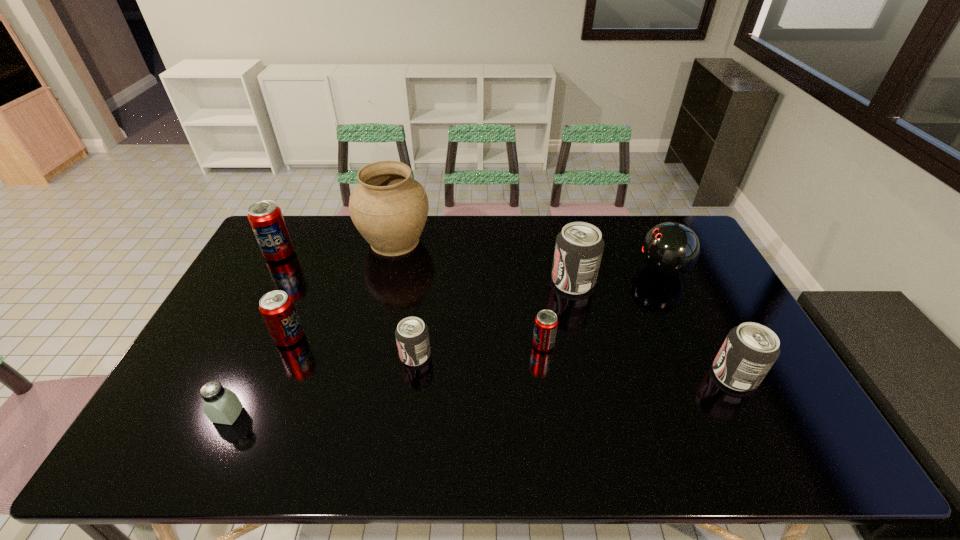
At what (x,y) coordinates should I click in order to perform the action: click on soda can positioned at the left edge. Please return your answer as a coordinate pair (x, y). Looking at the image, I should click on (266, 219).

Find the location of a particular element. saltshaker located at the left edge is located at coordinates (221, 405).

Locate an element on the screen. bowling ball located in the right edge section of the desktop is located at coordinates (670, 249).

Find the location of a particular element. soda can situated at the right edge is located at coordinates (750, 350).

The width and height of the screenshot is (960, 540). I want to click on object that is positioned at the far left corner, so click(x=266, y=219).

The image size is (960, 540). What are the coordinates of `object that is positioned at the far right corner` in the screenshot? It's located at (670, 249).

The image size is (960, 540). I want to click on vacant area at the far edge of the desktop, so click(x=612, y=251).

Identify the location of free space at the near edge of the desktop. This screenshot has height=540, width=960. (659, 433).

Where is `vacant space at the left edge`? vacant space at the left edge is located at coordinates (189, 407).

The width and height of the screenshot is (960, 540). Identify the location of vacant region at the right edge. (766, 376).